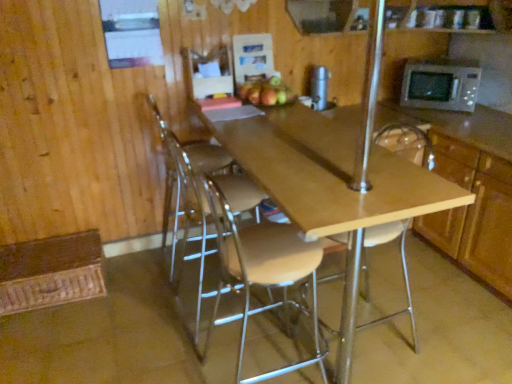
Locate an element on the screen. vacant space positioned to the left of light brown wood stool at center, positioned as the 2th chair in right-to-left order is located at coordinates (176, 355).